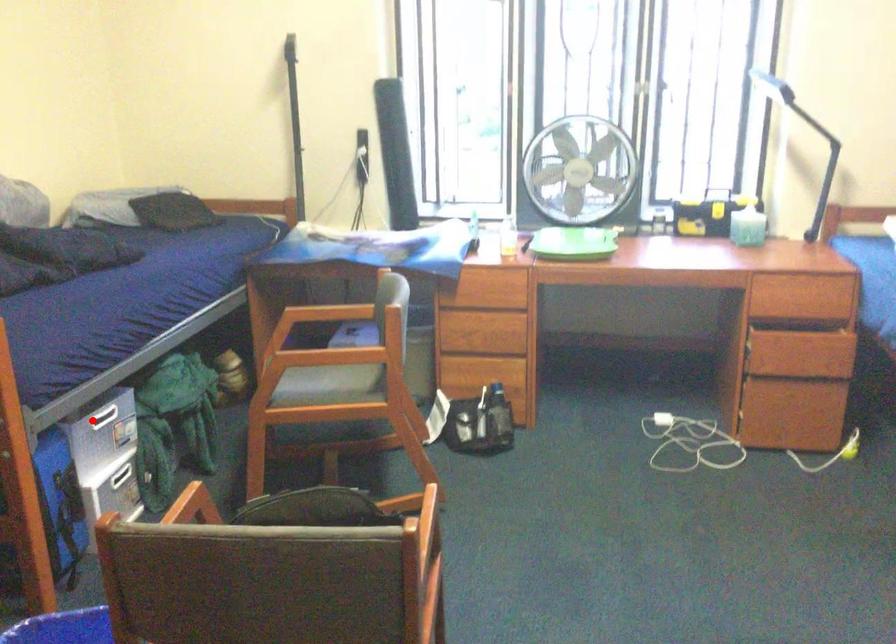
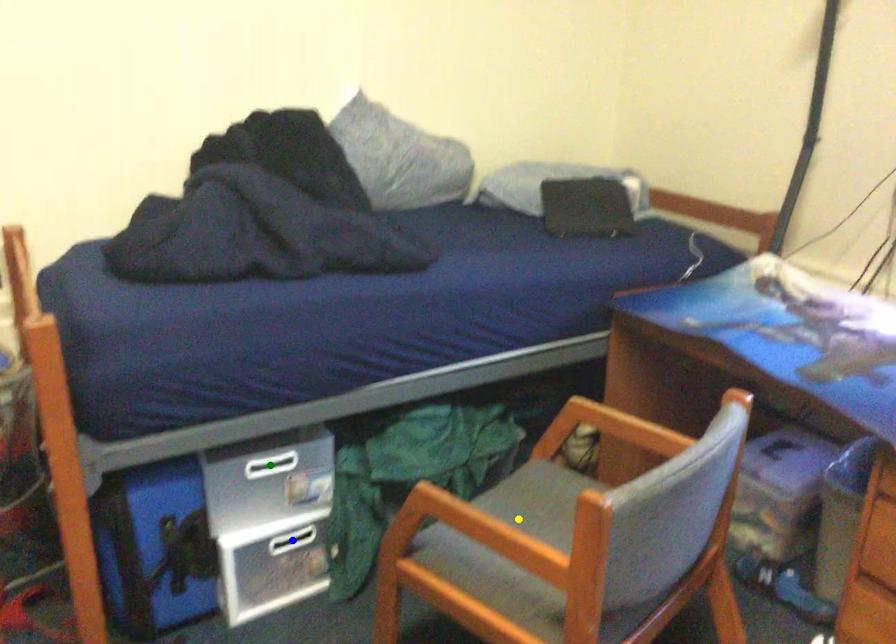
Question: I am providing you with two images of the same scene from different viewpoints. A red point is marked on the first image. You are given multiple points on the second image. In image 2, which mark is for the same physical point as the one in image 1?

Choices:
 (A) yellow point
 (B) green point
 (C) blue point

Answer: (B)